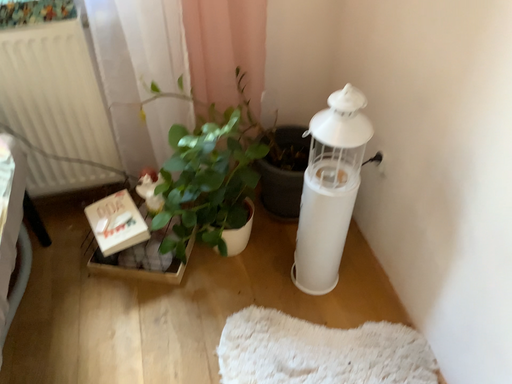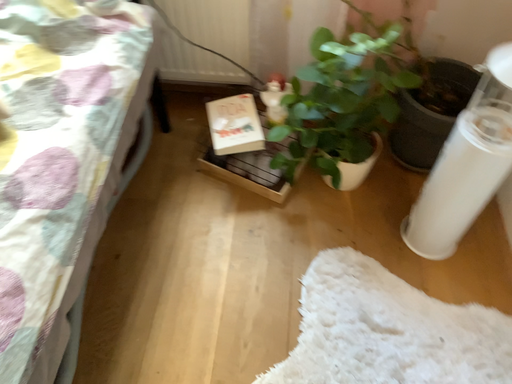
Question: How did the camera likely rotate when shooting the video?

Choices:
 (A) rotated upward
 (B) rotated downward

Answer: (B)